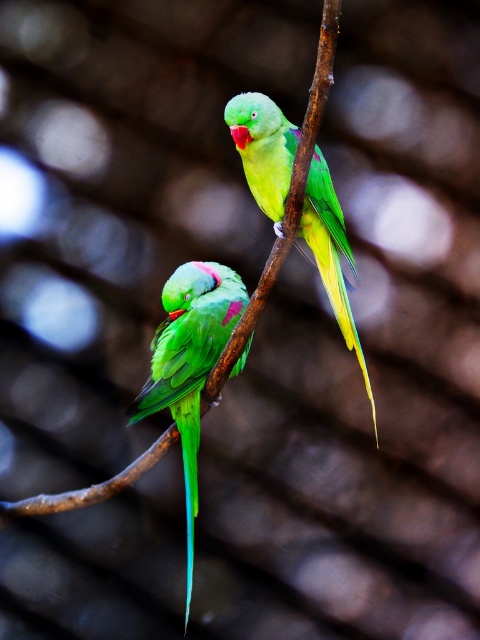
Does matte green parrot at center appear on the right side of green glossy parrot at center?

Incorrect, matte green parrot at center is not on the right side of green glossy parrot at center.

The image size is (480, 640). What do you see at coordinates (190, 364) in the screenshot?
I see `matte green parrot at center` at bounding box center [190, 364].

The width and height of the screenshot is (480, 640). Identify the location of matte green parrot at center. (190, 364).